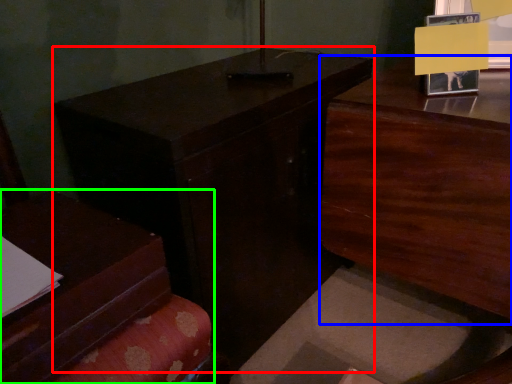
Question: Which object is positioned closest to table (highlighted by a red box)? Select from dresser (highlighted by a blue box) and furniture (highlighted by a green box).

Choices:
 (A) dresser
 (B) furniture

Answer: (B)